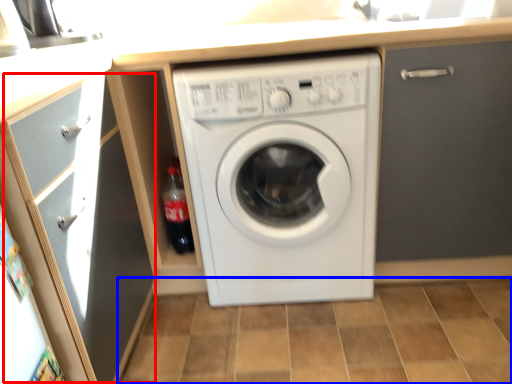
Question: Among these objects, which one is farthest to the camera, glass door (highlighted by a red box) or tile (highlighted by a blue box)?

Choices:
 (A) glass door
 (B) tile

Answer: (B)